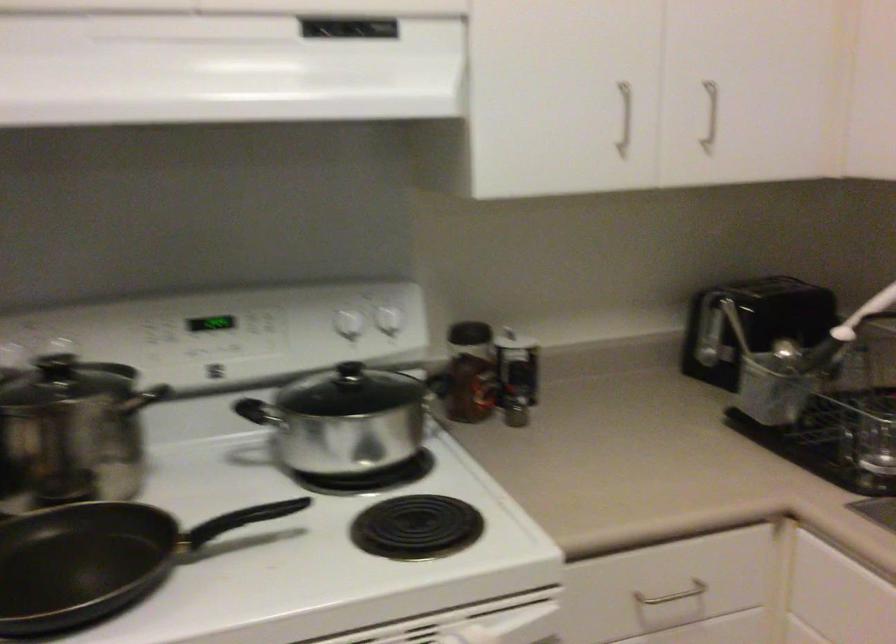
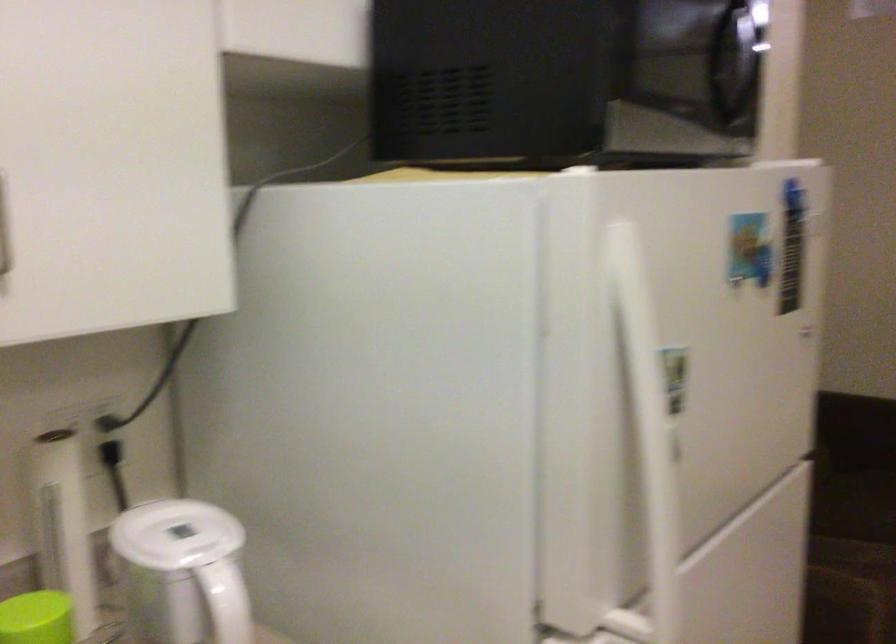
Question: How did the camera likely rotate?

Choices:
 (A) Left
 (B) Right
 (C) Up
 (D) Down

Answer: (B)